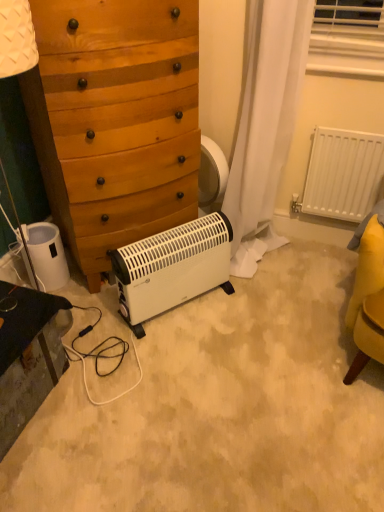
Where is `free space in front of white matte heater at center`? free space in front of white matte heater at center is located at coordinates (178, 367).